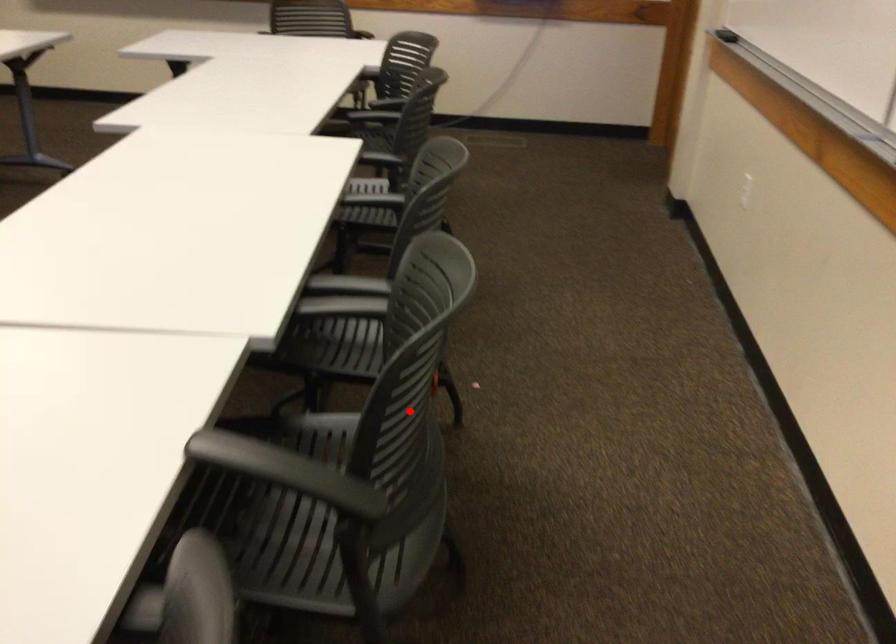
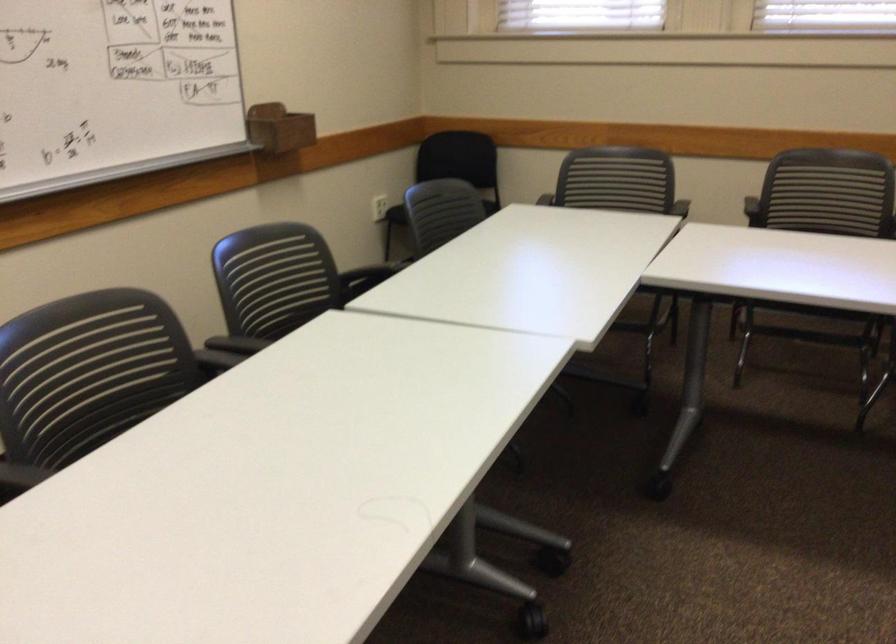
Where in the second image is the point corresponding to the highlighted location from the first image?

(276, 277)